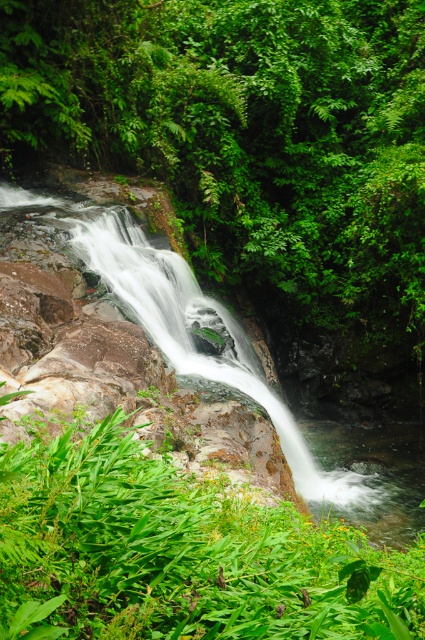
Who is positioned more to the right, green leafy plant at lower left or smooth rock waterfall at center?

From the viewer's perspective, smooth rock waterfall at center appears more on the right side.

Is point (340, 573) farther from viewer compared to point (133, 240)?

No, (340, 573) is in front of (133, 240).

The width and height of the screenshot is (425, 640). In order to click on green leafy plant at lower left in this screenshot , I will do `click(181, 554)`.

Between green leafy tree at center and green leafy plant at lower left, which one appears on the right side from the viewer's perspective?

green leafy plant at lower left

Does green leafy tree at center appear on the left side of green leafy plant at lower left?

Yes, green leafy tree at center is to the left of green leafy plant at lower left.

Between point (2, 134) and point (382, 634), which one is positioned behind?

The point (2, 134) is behind.

At what (x,y) coordinates should I click in order to perform the action: click on green leafy tree at center. Please return your answer as a coordinate pair (x, y). Looking at the image, I should click on (248, 132).

Who is positioned more to the right, green leafy tree at center or smooth rock waterfall at center?

smooth rock waterfall at center

This screenshot has height=640, width=425. What are the coordinates of `green leafy tree at center` in the screenshot? It's located at (248, 132).

Locate an element on the screen. green leafy tree at center is located at coordinates (248, 132).